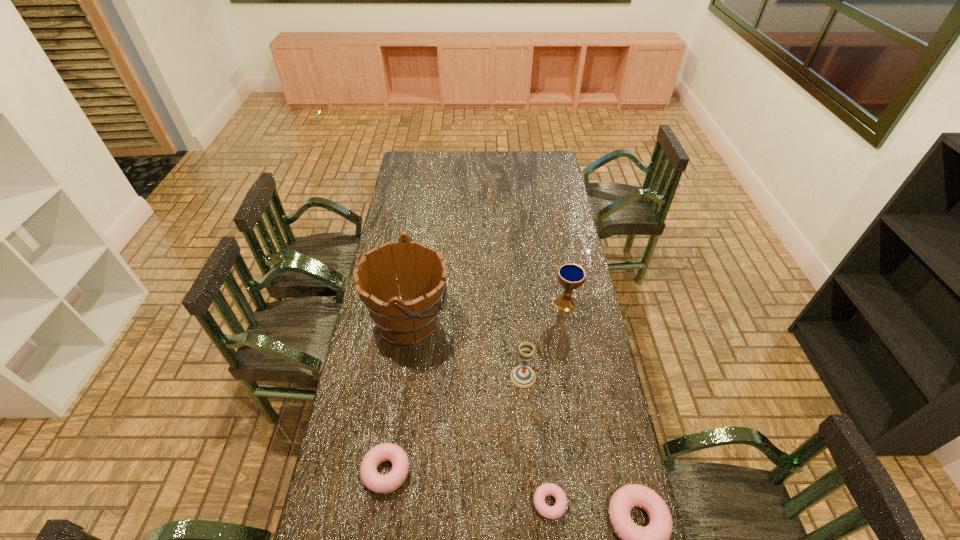
Image resolution: width=960 pixels, height=540 pixels. In order to click on vacant region located with the handle on the tallest object in this screenshot , I will do `click(536, 322)`.

Locate an element on the screen. This screenshot has height=540, width=960. vacant region located 0.340m on the front of the fourth nearest object is located at coordinates (532, 489).

What are the coordinates of `blank area located on the left of the right chalice` in the screenshot? It's located at (526, 302).

This screenshot has width=960, height=540. Find the location of `object that is positioned at the near edge`. object that is positioned at the near edge is located at coordinates (554, 512).

Find the location of a particular element. doughnut that is at the left edge is located at coordinates (371, 479).

This screenshot has width=960, height=540. In order to click on wine bucket positioned at the left edge in this screenshot , I will do `click(412, 318)`.

Locate an element on the screen. This screenshot has width=960, height=540. object located at the right edge is located at coordinates (571, 276).

Image resolution: width=960 pixels, height=540 pixels. In the image, there is a desktop. Identify the location of free space at the far edge. coord(497,156).

The width and height of the screenshot is (960, 540). In the image, there is a desktop. What are the coordinates of `vacant space at the near edge` in the screenshot? It's located at (535, 530).

In the image, there is a desktop. Where is `vacant space at the left edge`? The width and height of the screenshot is (960, 540). vacant space at the left edge is located at coordinates (365, 420).